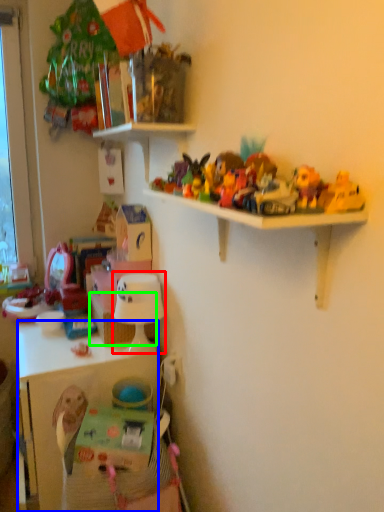
Question: Which is farther away from lamp (highlighted by a red box)? cabinetry (highlighted by a blue box) or basket (highlighted by a green box)?

Choices:
 (A) cabinetry
 (B) basket

Answer: (A)